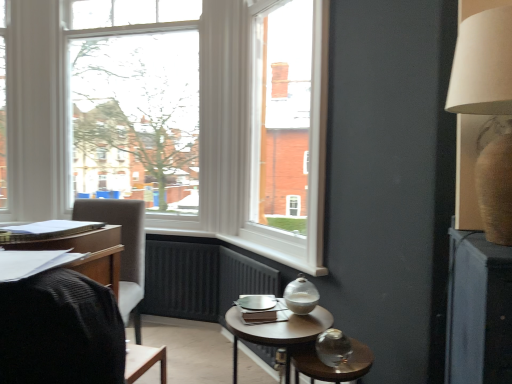
You are a GUI agent. You are given a task and a screenshot of the screen. Output one action in this format:
    pyautogui.click(x=<x>, y=<y>)
    Task: Click on the free space above wooden round table at center (from a real-world perspective)
    This screenshot has width=512, height=384.
    Given the screenshot: What is the action you would take?
    pyautogui.click(x=281, y=322)